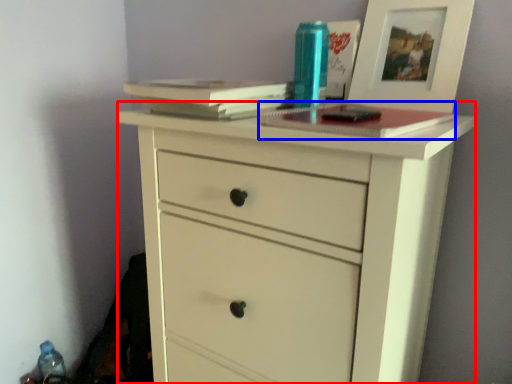
Question: Which of the following is the closest to the observer, chest of drawers (highlighted by a red box) or paperback book (highlighted by a blue box)?

Choices:
 (A) chest of drawers
 (B) paperback book

Answer: (A)